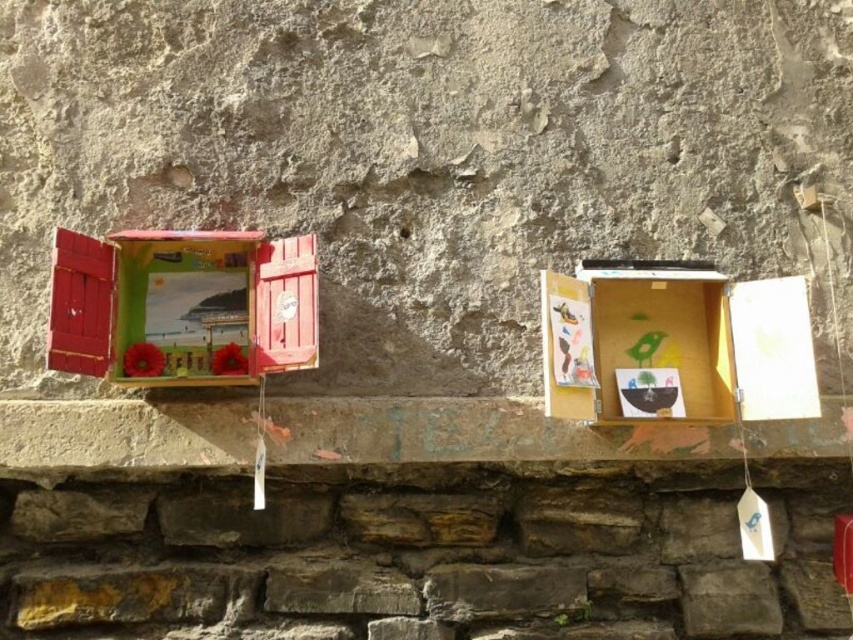
Which is in front, point (184, 458) or point (108, 282)?

Positioned in front is point (108, 282).

This screenshot has width=853, height=640. What are the coordinates of `smooth stone ledge at center` in the screenshot? It's located at (469, 433).

Is smooth stone ledge at center bigger than wooden box at center?

Actually, smooth stone ledge at center might be smaller than wooden box at center.

Can you confirm if smooth stone ledge at center is smaller than wooden box at center?

Correct, smooth stone ledge at center occupies less space than wooden box at center.

Does point (219, 422) come closer to viewer compared to point (601, 369)?

Yes, point (219, 422) is closer to viewer.

This screenshot has height=640, width=853. I want to click on smooth stone ledge at center, so click(x=469, y=433).

Can you confirm if matte wooden window at left is taller than wooden box at center?

Yes, matte wooden window at left is taller than wooden box at center.

Does matte wooden window at left appear on the right side of wooden box at center?

No, matte wooden window at left is not to the right of wooden box at center.

Who is more distant from viewer, (309, 349) or (544, 300)?

Point (544, 300)

In order to click on matte wooden window at left in this screenshot , I will do `click(183, 307)`.